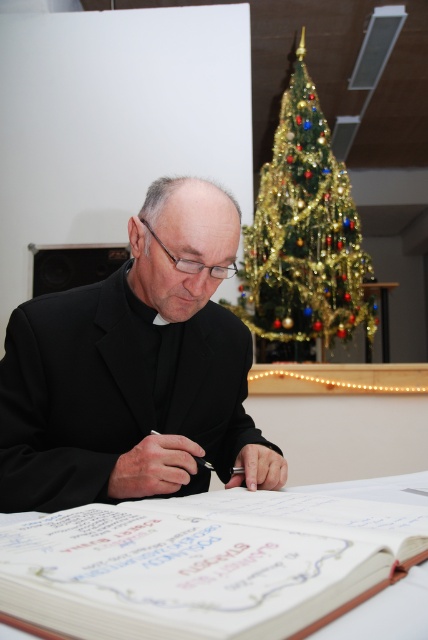
Question: Is black matte suit at center further to the viewer compared to white paper book at center?

Choices:
 (A) yes
 (B) no

Answer: (A)

Question: Is black matte suit at center smaller than white paper book at center?

Choices:
 (A) no
 (B) yes

Answer: (A)

Question: Which of these objects is positioned farthest from the white paper book at center?

Choices:
 (A) green glittery christmas tree at upper center
 (B) black matte suit at center

Answer: (A)

Question: Which point is farther to the camera?

Choices:
 (A) green glittery christmas tree at upper center
 (B) white paper book at center
 (C) black matte suit at center

Answer: (A)

Question: Estimate the real-world distances between objects in this image. Which object is closer to the black matte suit at center?

Choices:
 (A) white paper book at center
 (B) green glittery christmas tree at upper center

Answer: (A)

Question: Can you confirm if black matte suit at center is smaller than green glittery christmas tree at upper center?

Choices:
 (A) yes
 (B) no

Answer: (A)